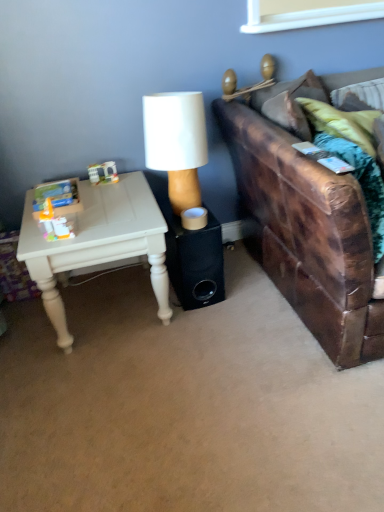
Question: In the image, is white painted wood table at left positioned in front of or behind brown leather couch at right?

Choices:
 (A) behind
 (B) front

Answer: (A)

Question: Considering the positions of point (44, 303) and point (279, 169), is point (44, 303) closer or farther from the camera than point (279, 169)?

Choices:
 (A) farther
 (B) closer

Answer: (A)

Question: Which of these objects is positioned farthest from the white painted wood table at left?

Choices:
 (A) brown leather couch at right
 (B) black matte speaker at center
 (C) white matte lamp at center

Answer: (A)

Question: Which of these objects is positioned closest to the white painted wood table at left?

Choices:
 (A) white matte lamp at center
 (B) brown leather couch at right
 (C) black matte speaker at center

Answer: (C)